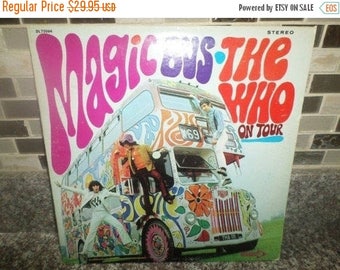
Where is `counter top`? counter top is located at coordinates (18, 216).